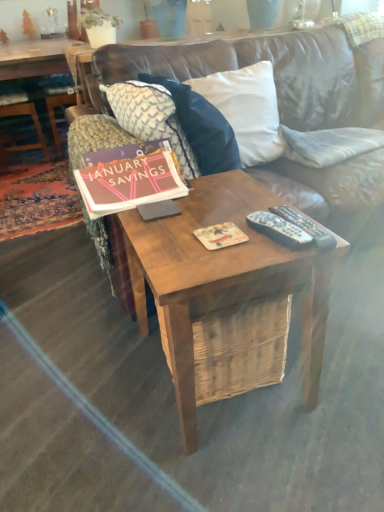
You are a GUI agent. You are given a task and a screenshot of the screen. Output one action in this format:
    pyautogui.click(x=<x>, y=<y>)
    Task: Click on the free space behind black plastic remote controls at center, placed as the 1th remote control when sorted from left to right
    The width and height of the screenshot is (384, 512).
    Given the screenshot: What is the action you would take?
    pyautogui.click(x=246, y=200)